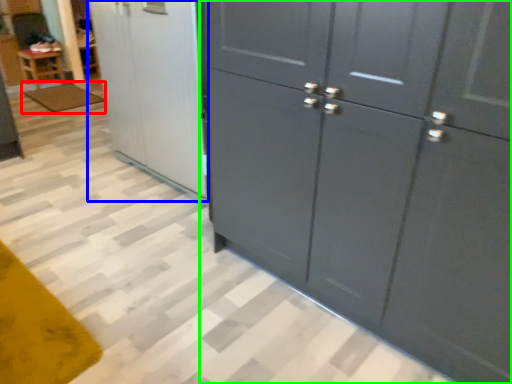
Question: Which object is the closest to the mat (highlighted by a red box)? Choose among these: screen door (highlighted by a blue box) or cupboard (highlighted by a green box).

Choices:
 (A) screen door
 (B) cupboard

Answer: (A)